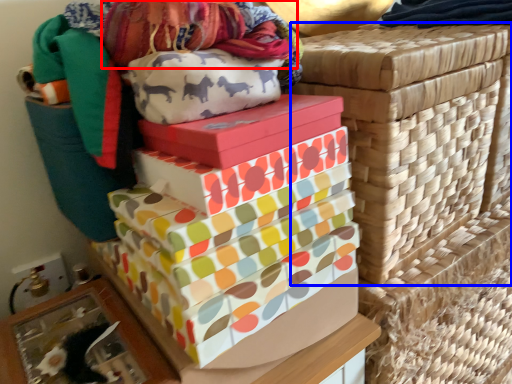
Question: Which of the following is the farthest to the observer, fabric (highlighted by a red box) or basket container (highlighted by a blue box)?

Choices:
 (A) fabric
 (B) basket container

Answer: (B)